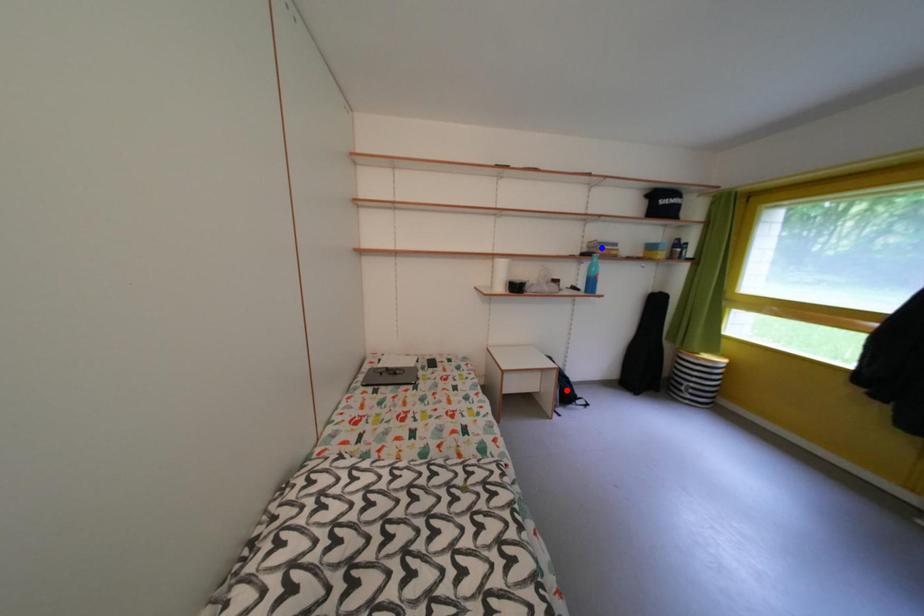
Question: Two points are marked on the image. Which point is closer to the camera?

Choices:
 (A) Blue point is closer.
 (B) Red point is closer.

Answer: (B)